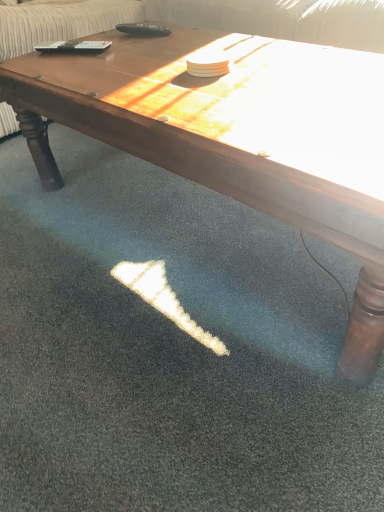
The height and width of the screenshot is (512, 384). What do you see at coordinates (237, 137) in the screenshot? I see `wooden coffee table at center` at bounding box center [237, 137].

Where is `wooden coffee table at center`? wooden coffee table at center is located at coordinates (237, 137).

Locate an element on the screen. This screenshot has height=512, width=384. wooden coffee table at center is located at coordinates (237, 137).